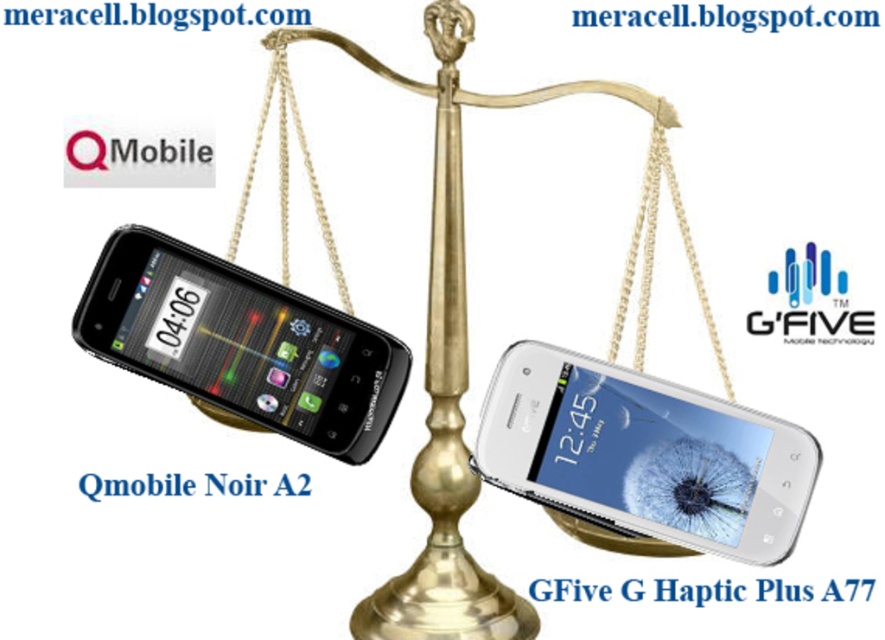
Does white glossy smartphone at center have a smaller size compared to black glossy qmobile noir a2 at left?

No.

Is point (550, 483) farther from viewer compared to point (335, 403)?

No, it is not.

Find the location of `white glossy smartphone at center`. white glossy smartphone at center is located at coordinates (644, 454).